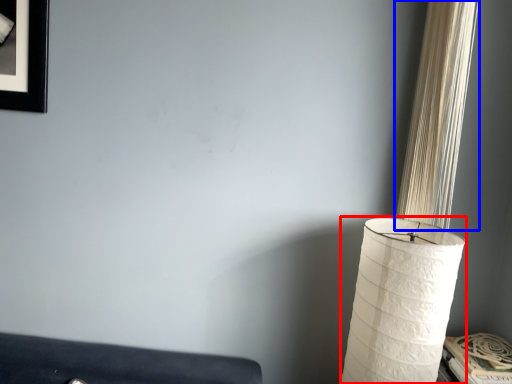
Question: Which object appears closest to the camera in this image, lamp (highlighted by a red box) or curtain (highlighted by a blue box)?

Choices:
 (A) lamp
 (B) curtain

Answer: (A)